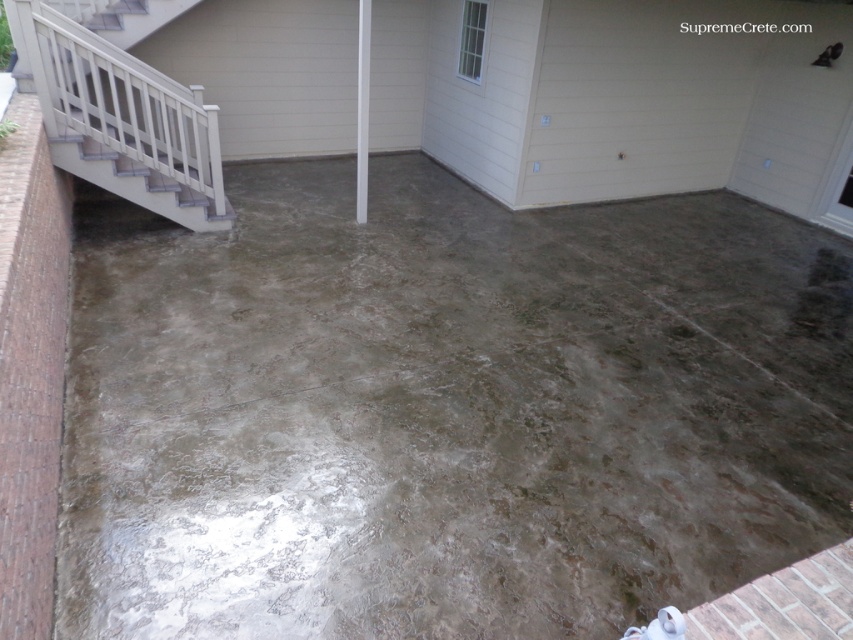
Question: Estimate the real-world distances between objects in this image. Which object is farther from the white painted wood stairs at upper left?

Choices:
 (A) textured concrete at center
 (B) white smooth pole at center

Answer: (A)

Question: From the image, what is the correct spatial relationship of white painted wood stairs at upper left in relation to white smooth pole at center?

Choices:
 (A) above
 (B) below

Answer: (A)

Question: Which point is farther to the camera?

Choices:
 (A) (152, 108)
 (B) (363, 22)
 (C) (143, 472)

Answer: (A)

Question: Is textured concrete at center to the left of white smooth pole at center from the viewer's perspective?

Choices:
 (A) no
 (B) yes

Answer: (A)

Question: Where is textured concrete at center located in relation to white smooth pole at center in the image?

Choices:
 (A) above
 (B) below

Answer: (B)

Question: Which object appears closest to the camera in this image?

Choices:
 (A) white smooth pole at center
 (B) textured concrete at center

Answer: (B)